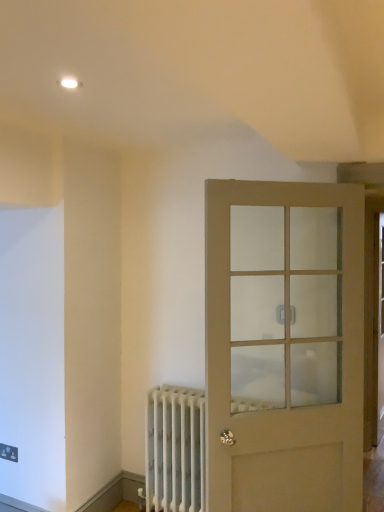
Question: Should I look upward or downward to see matte beige door at right?

Choices:
 (A) up
 (B) down

Answer: (B)

Question: Can you confirm if white metal radiator at lower left is taller than matte beige door at right?

Choices:
 (A) yes
 (B) no

Answer: (B)

Question: From the image's perspective, is white metal radiator at lower left located beneath matte beige door at right?

Choices:
 (A) no
 (B) yes

Answer: (B)

Question: From the image's perspective, is white metal radiator at lower left on matte beige door at right?

Choices:
 (A) yes
 (B) no

Answer: (B)

Question: Does white metal radiator at lower left turn towards matte beige door at right?

Choices:
 (A) yes
 (B) no

Answer: (B)

Question: From a real-world perspective, is white metal radiator at lower left on matte beige door at right?

Choices:
 (A) yes
 (B) no

Answer: (B)

Question: Is white metal radiator at lower left bigger than matte beige door at right?

Choices:
 (A) no
 (B) yes

Answer: (A)

Question: Considering the relative sizes of matte beige door at right and white metal radiator at lower left in the image provided, is matte beige door at right thinner than white metal radiator at lower left?

Choices:
 (A) no
 (B) yes

Answer: (B)

Question: From the image's perspective, is matte beige door at right located beneath white metal radiator at lower left?

Choices:
 (A) no
 (B) yes

Answer: (A)

Question: Is matte beige door at right touching white metal radiator at lower left?

Choices:
 (A) no
 (B) yes

Answer: (A)

Question: Could you tell me if matte beige door at right is turned towards white metal radiator at lower left?

Choices:
 (A) no
 (B) yes

Answer: (A)

Question: Is matte beige door at right to the left of white metal radiator at lower left from the viewer's perspective?

Choices:
 (A) no
 (B) yes

Answer: (A)

Question: Does matte beige door at right have a smaller size compared to white metal radiator at lower left?

Choices:
 (A) yes
 (B) no

Answer: (B)

Question: Relative to matte beige door at right, is white metal radiator at lower left in front or behind?

Choices:
 (A) front
 (B) behind

Answer: (B)